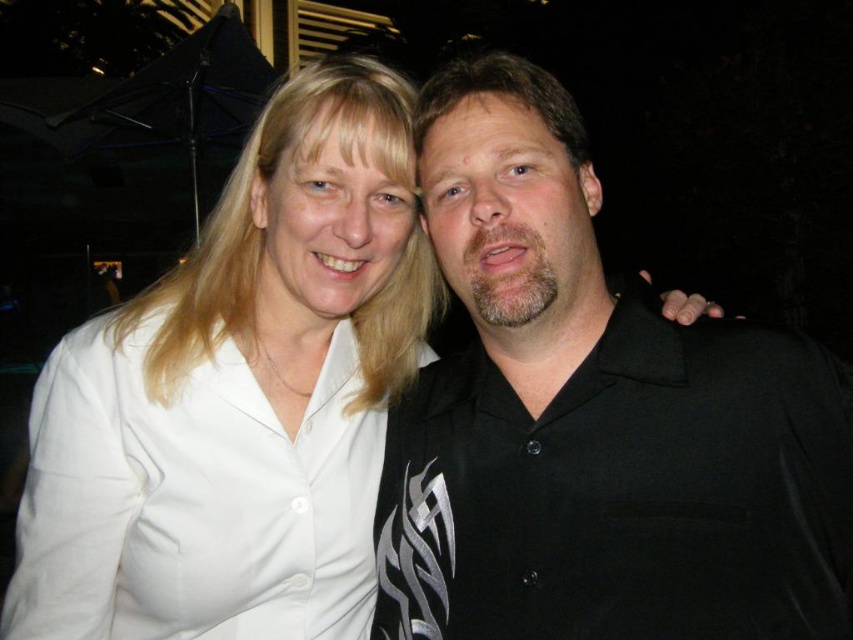
Question: Does black matte shirt at center have a smaller size compared to white smooth shirt at upper left?

Choices:
 (A) yes
 (B) no

Answer: (A)

Question: Which of the following is the closest to the observer?

Choices:
 (A) white smooth shirt at upper left
 (B) black matte shirt at center

Answer: (B)

Question: Is black matte shirt at center to the right of white smooth shirt at upper left from the viewer's perspective?

Choices:
 (A) yes
 (B) no

Answer: (A)

Question: Which point is closer to the camera?

Choices:
 (A) white smooth shirt at upper left
 (B) black matte shirt at center

Answer: (B)

Question: Is black matte shirt at center to the right of white smooth shirt at upper left from the viewer's perspective?

Choices:
 (A) no
 (B) yes

Answer: (B)

Question: Among these objects, which one is nearest to the camera?

Choices:
 (A) black matte shirt at center
 (B) white smooth shirt at upper left

Answer: (A)